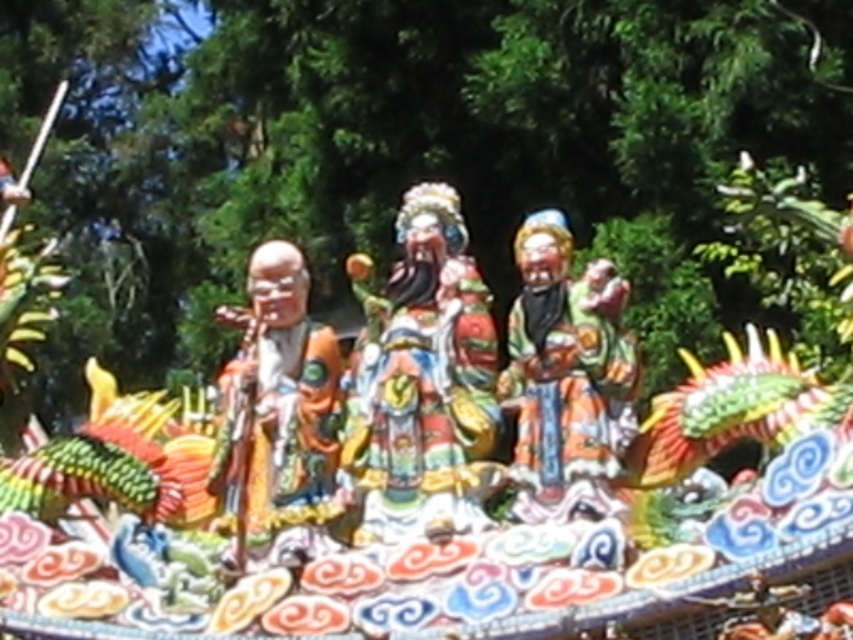
You are an art curator planning to display the multicolored glossy statue at center and the matte orange robe at left in a new exhibition. Given their height differences, which object should be placed on a higher pedestal to ensure both are visible to visitors?

The multicolored glossy statue at center should be placed on a higher pedestal since it is taller than the matte orange robe at left, ensuring both are visible to visitors.

You are a photographer standing 10 meters away from the float. You want to take a photo of the matte orange robe at left and the matte painted figure at center in the same frame. Given the distance between them is 12.31 meters, will you be able to capture both in one shot if your camera has a 50mm lens?

The distance between the matte orange robe at left and the matte painted figure at center is 12.31 meters. With a 50mm lens, the field of view at 10 meters would typically allow capturing objects within a certain width. However, 12.31 meters separation might exceed the lens capability, so it depends on the camera sensor size and zoom level. Without specific sensor details, it is uncertain.